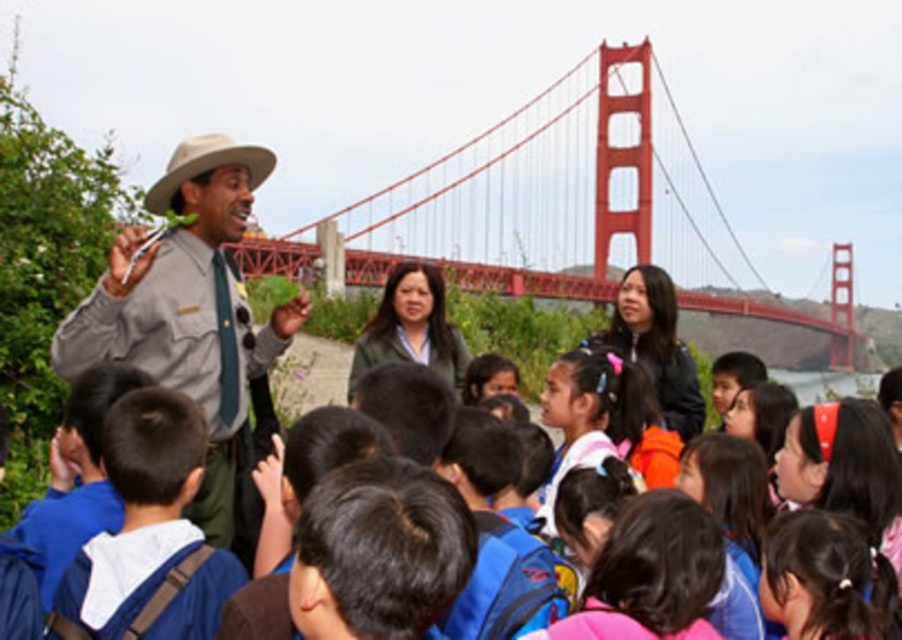
Question: Which point is farther to the camera?

Choices:
 (A) gray uniform at center
 (B) red painted steel suspension bridge at upper center
 (C) blue fabric backpack at center

Answer: (B)

Question: Which point appears closest to the camera in this image?

Choices:
 (A) (594, 163)
 (B) (152, 556)
 (C) (118, 248)

Answer: (B)

Question: Is gray uniform at center closer to the viewer compared to blue fabric backpack at center?

Choices:
 (A) no
 (B) yes

Answer: (A)

Question: Which point is closer to the camera?

Choices:
 (A) red painted steel suspension bridge at upper center
 (B) gray uniform at center

Answer: (B)

Question: Is red painted steel suspension bridge at upper center above gray uniform at center?

Choices:
 (A) yes
 (B) no

Answer: (A)

Question: Can you confirm if gray uniform at center is positioned to the right of blue fabric backpack at center?

Choices:
 (A) yes
 (B) no

Answer: (B)